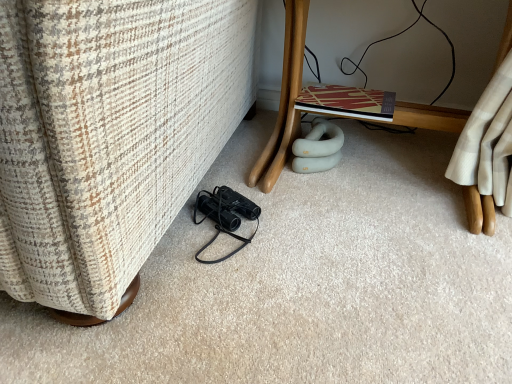
You are a GUI agent. You are given a task and a screenshot of the screen. Output one action in this format:
    pyautogui.click(x=<x>, y=<y>)
    Task: Click on the free location in front of wooden table at lower center
    The height and width of the screenshot is (384, 512).
    Given the screenshot: What is the action you would take?
    pyautogui.click(x=348, y=286)